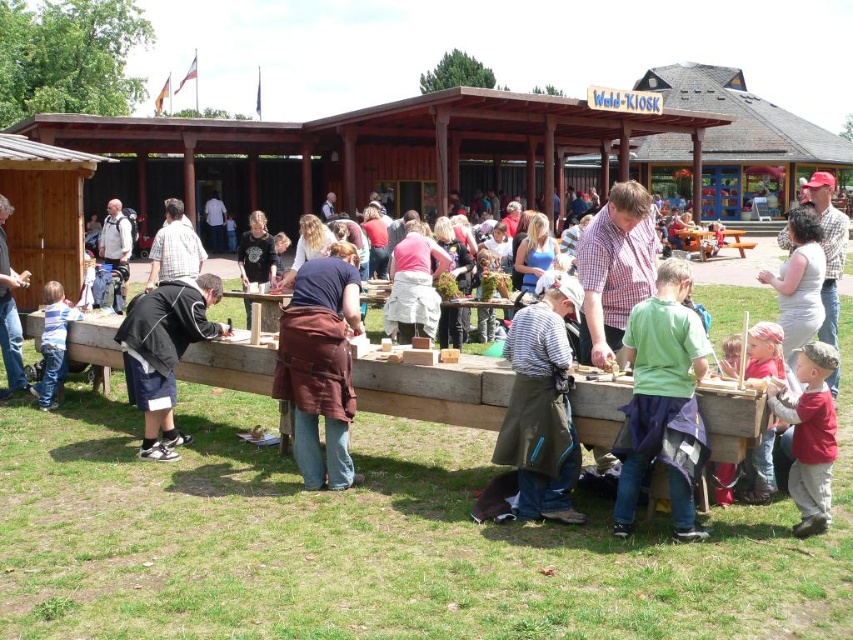
You are standing at the wooden table in front of the Wald Kiosk and want to reach two points marked in the scene. Which point, point (334, 396) or point (50, 365), is closer to you?

Point (334, 396) is closer to the viewer than point (50, 365).

You are at the Wald Kiosk event and need to locate two participants. One is wearing a brown leather apron at center, and the other has a red cotton shirt at lower right. From the perspective of someone standing at the wooden table, which participant is positioned to the right?

The red cotton shirt at lower right is to the right of the brown leather apron at center, so the participant in the red cotton shirt at lower right is positioned to the right.